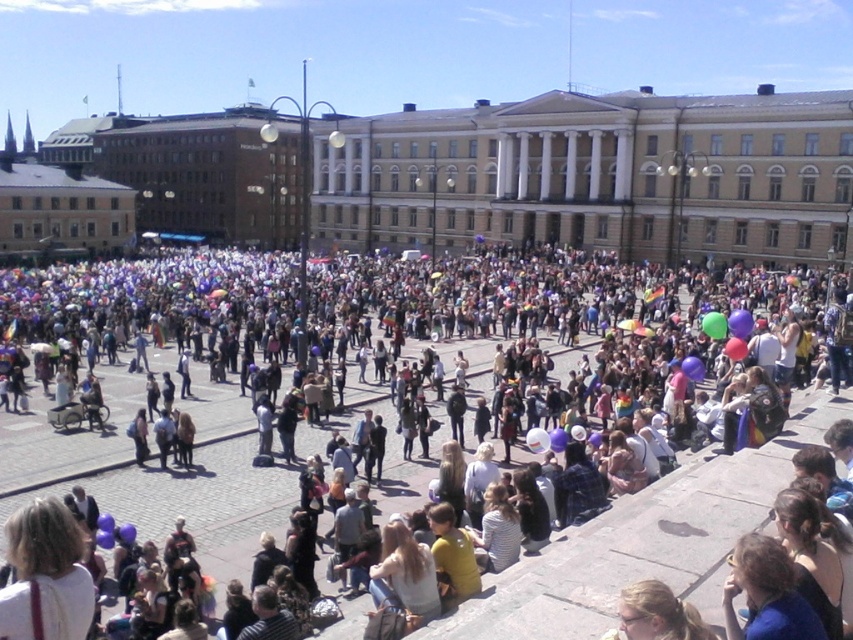
Question: Is yellow stone building at center below translucent purple balloon at center?

Choices:
 (A) yes
 (B) no

Answer: (B)

Question: Which object is the closest to the translucent purple balloon at center?

Choices:
 (A) dark blue shirt at lower right
 (B) matte black wheelchair at lower left

Answer: (B)

Question: Which object is positioned closest to the dark blue shirt at lower right?

Choices:
 (A) yellow stone building at center
 (B) translucent purple balloon at center
 (C) light brown hair at lower center

Answer: (C)

Question: Can you confirm if dark blue shirt at lower right is wider than light brown hair at lower center?

Choices:
 (A) yes
 (B) no

Answer: (B)

Question: Is yellow stone building at center to the right of dark blue shirt at lower right from the viewer's perspective?

Choices:
 (A) yes
 (B) no

Answer: (B)

Question: Which of the following is the farthest from the observer?

Choices:
 (A) (515, 124)
 (B) (735, 308)

Answer: (A)